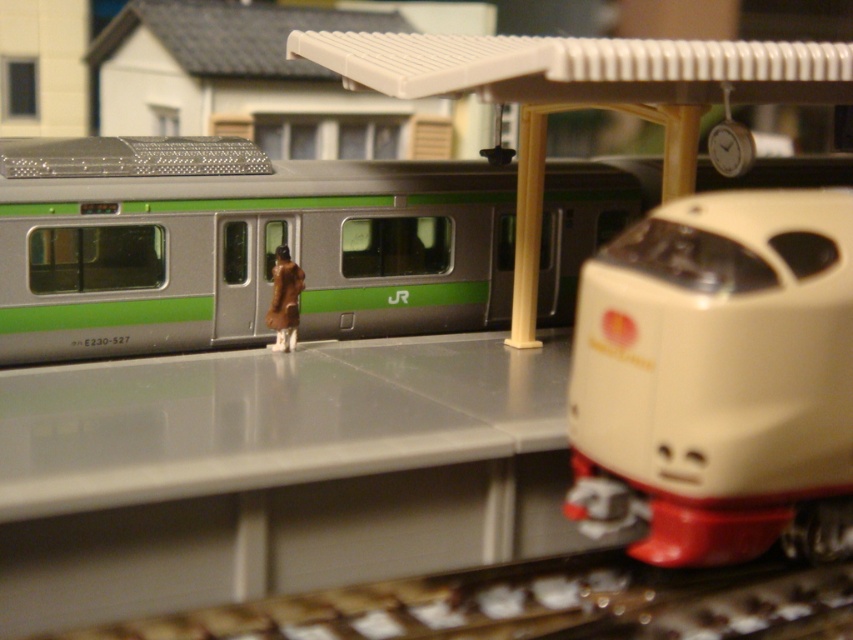
You are a model train enthusiast examining the scene. You notice the beige plastic train at center and the brown fur coat at center. Which object is positioned closer to you?

The beige plastic train at center is closer to the viewer than the brown fur coat at center.